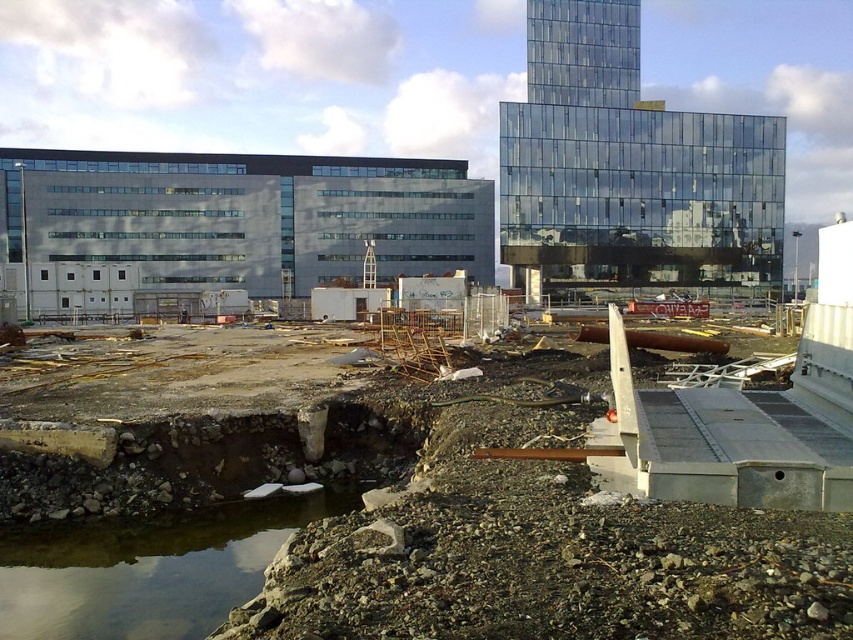
Question: Does gray concrete building at left have a lesser width compared to transparent glass building at upper center?

Choices:
 (A) no
 (B) yes

Answer: (A)

Question: Considering the relative positions of rustic concrete foundation at center and transparent glass building at upper center in the image provided, where is rustic concrete foundation at center located with respect to transparent glass building at upper center?

Choices:
 (A) below
 (B) above

Answer: (A)

Question: Can you confirm if rustic concrete foundation at center is positioned above gray concrete building at left?

Choices:
 (A) no
 (B) yes

Answer: (A)

Question: Which object is positioned closest to the transparent glass building at upper center?

Choices:
 (A) gray concrete building at left
 (B) rustic concrete foundation at center

Answer: (A)

Question: Among these points, which one is nearest to the camera?

Choices:
 (A) (114, 182)
 (B) (502, 138)
 (C) (102, 545)

Answer: (C)

Question: Based on their relative distances, which object is nearer to the gray concrete building at left?

Choices:
 (A) rustic concrete foundation at center
 (B) transparent glass building at upper center

Answer: (B)